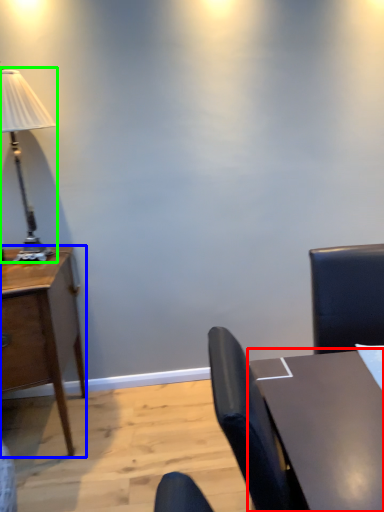
Question: Which is nearer to the table (highlighted by a red box)? desk (highlighted by a blue box) or lamp (highlighted by a green box).

Choices:
 (A) desk
 (B) lamp

Answer: (A)